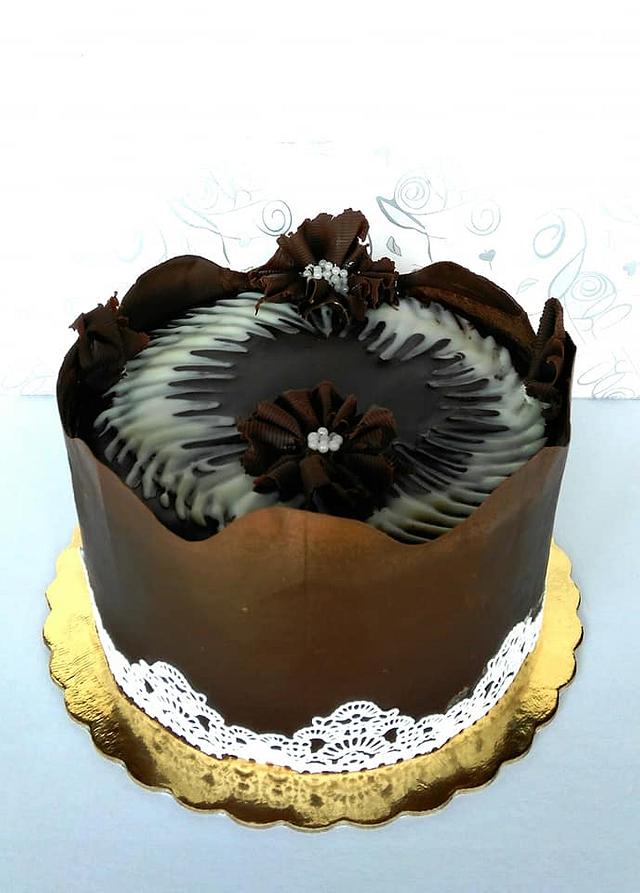
You are a GUI agent. You are given a task and a screenshot of the screen. Output one action in this format:
    pyautogui.click(x=<x>, y=<y>)
    Task: Click on the tabletop
    The height and width of the screenshot is (893, 640).
    Given the screenshot: What is the action you would take?
    pyautogui.click(x=95, y=821)